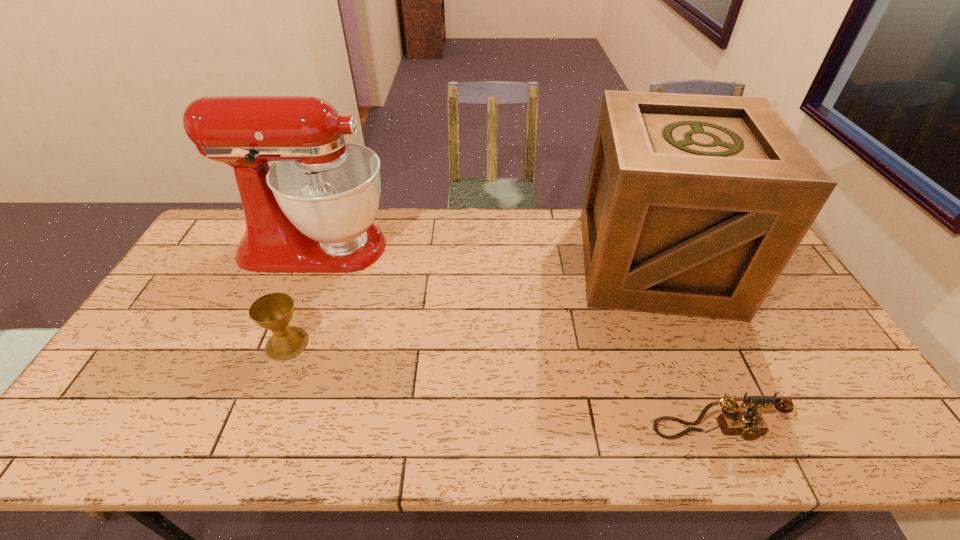
Where is `unoccupied position between the mixer and the third farthest object`? This screenshot has height=540, width=960. unoccupied position between the mixer and the third farthest object is located at coordinates tap(301, 295).

This screenshot has height=540, width=960. In order to click on vacant area between the mixer and the third farthest object in this screenshot , I will do `click(301, 295)`.

You are a GUI agent. You are given a task and a screenshot of the screen. Output one action in this format:
    pyautogui.click(x=<x>, y=<y>)
    Task: Click on the free space that is in between the mixer and the chalice
    
    Given the screenshot: What is the action you would take?
    pyautogui.click(x=301, y=295)

Locate an element on the screen. This screenshot has height=540, width=960. free space between the telephone and the mixer is located at coordinates (515, 339).

At what (x,y) coordinates should I click in order to perform the action: click on free spot between the nearest object and the box. Please return your answer as a coordinate pair (x, y). This screenshot has height=540, width=960. Looking at the image, I should click on (684, 346).

Find the location of a particular element. This screenshot has height=540, width=960. empty space that is in between the mixer and the second nearest object is located at coordinates (301, 295).

Locate an element on the screen. The image size is (960, 540). free space between the nearest object and the box is located at coordinates (684, 346).

Where is `object that is the third nearest to the box`? Image resolution: width=960 pixels, height=540 pixels. object that is the third nearest to the box is located at coordinates (273, 311).

I want to click on the closest object to the nearest object, so click(x=694, y=204).

You are a GUI agent. You are given a task and a screenshot of the screen. Output one action in this format:
    pyautogui.click(x=<x>, y=<y>)
    Task: Click on the vacant region that satisfies the following two spatial constraints: 1. at the attachment hub of the mixer; 2. on the right side of the chalice
    The width and height of the screenshot is (960, 540).
    Given the screenshot: What is the action you would take?
    pyautogui.click(x=276, y=343)